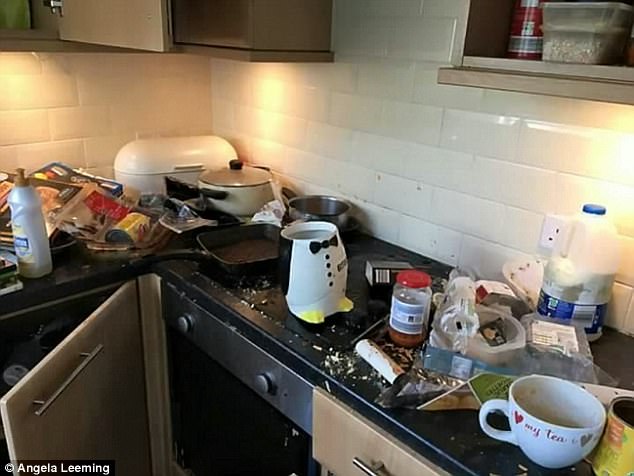
The height and width of the screenshot is (476, 634). What are the coordinates of `upper cabinet` in the screenshot? It's located at (529, 66).